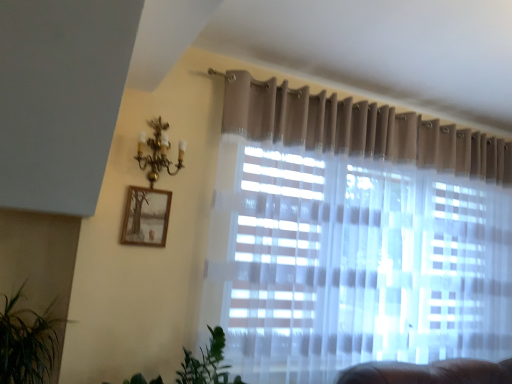
Question: Should I look upward or downward to see wooden frame at upper left?

Choices:
 (A) up
 (B) down

Answer: (B)